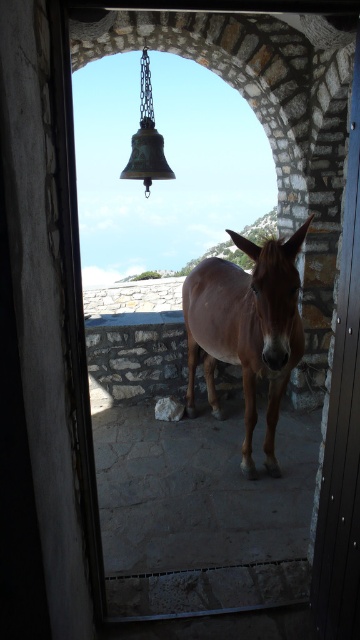
The image size is (360, 640). In order to click on brown matte mule at center in this screenshot , I will do `click(246, 328)`.

Looking at this image, is brown matte mule at center taller than metallic gray door at center?

No.

Where is `brown matte mule at center`? brown matte mule at center is located at coordinates (246, 328).